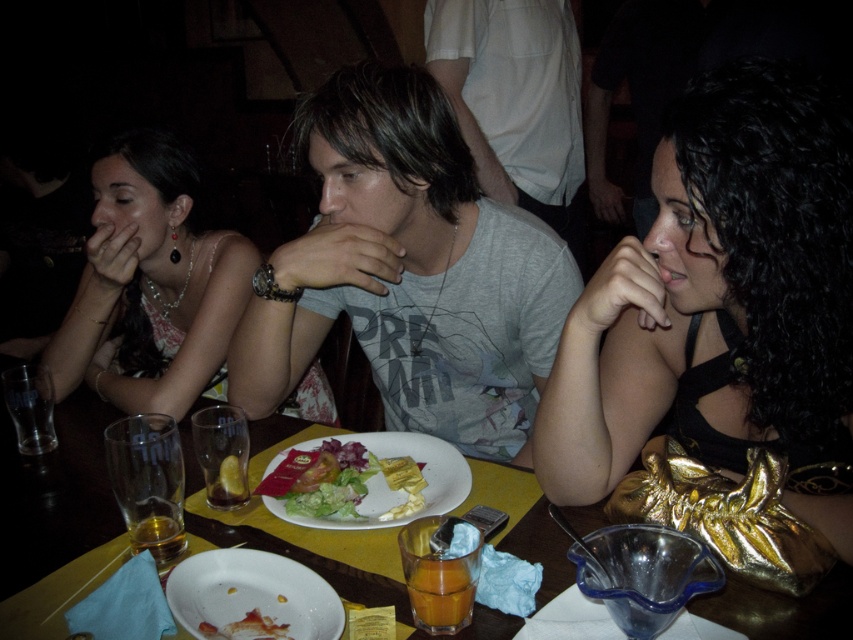
Question: Estimate the real-world distances between objects in this image. Which object is farther from the gray matte t-shirt at center?

Choices:
 (A) shiny gold purse at center right
 (B) gray cotton shirt at center
 (C) translucent glass at lower left

Answer: (B)

Question: Which point is closer to the camera taking this photo?

Choices:
 (A) (383, 480)
 (B) (646, 320)
 (C) (457, 618)
 (D) (502, 417)

Answer: (C)

Question: Based on their relative distances, which object is nearer to the gray cotton shirt at center?

Choices:
 (A) shiny gold purse at center right
 (B) matte silver necklace at upper left

Answer: (B)

Question: Is yellow matte table at center wider than translucent glass at lower left?

Choices:
 (A) no
 (B) yes

Answer: (B)

Question: Is the position of shiny gold purse at center right more distant than that of translucent glass cup at lower center?

Choices:
 (A) yes
 (B) no

Answer: (B)

Question: Does matte silver necklace at upper left have a greater width compared to yellow matte table at center?

Choices:
 (A) yes
 (B) no

Answer: (B)